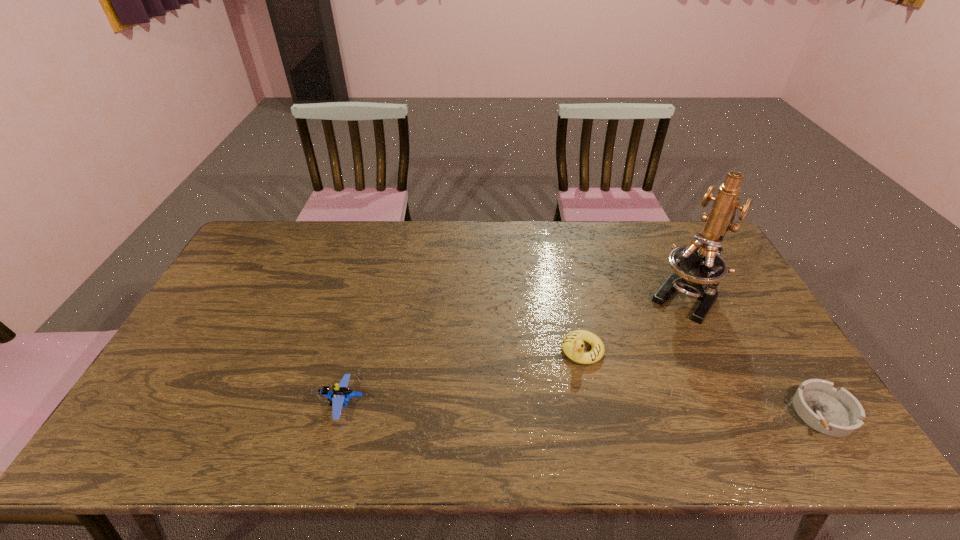
The image size is (960, 540). What are the coordinates of `the leftmost object` in the screenshot? It's located at (338, 398).

You are a GUI agent. You are given a task and a screenshot of the screen. Output one action in this format:
    pyautogui.click(x=<x>, y=<y>)
    Task: Click on the rightmost object
    This screenshot has width=960, height=540.
    Given the screenshot: What is the action you would take?
    pyautogui.click(x=837, y=413)

The height and width of the screenshot is (540, 960). I want to click on ashtray, so click(837, 413).

Identify the location of the farthest object. (698, 268).

The height and width of the screenshot is (540, 960). Identify the location of microscope. (698, 268).

Where is `the third nearest object`? the third nearest object is located at coordinates (572, 344).

Identify the location of duckling. (572, 344).

At what (x,y) coordinates should I click in order to perform the action: click on free space located 0.310m on the front-facing side of the Lego. Please return your answer as a coordinate pair (x, y). The width and height of the screenshot is (960, 540). Looking at the image, I should click on (199, 404).

The image size is (960, 540). In order to click on vacant region located 0.070m on the front-facing side of the Lego in this screenshot , I will do `click(295, 404)`.

Identify the location of free space located on the front-facing side of the Lego. (295, 404).